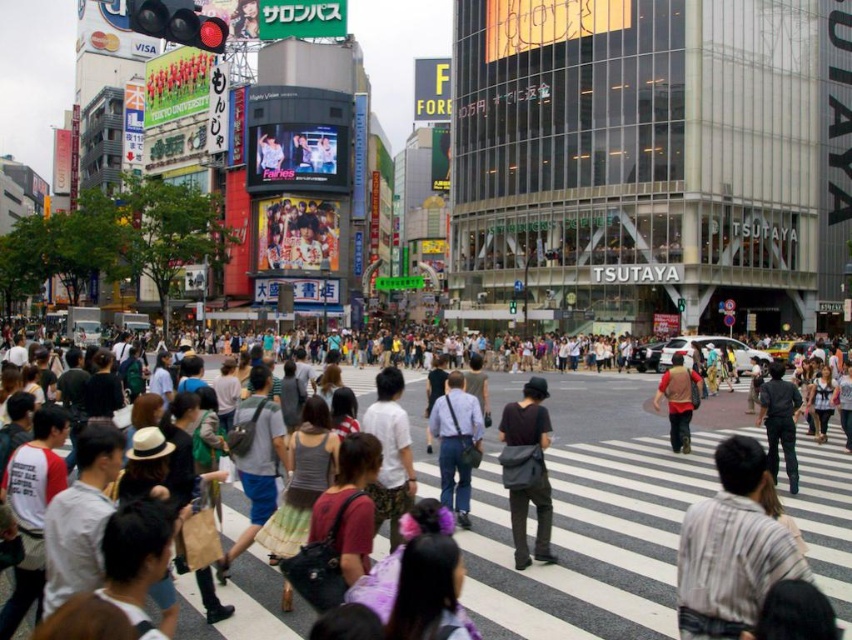
Is the position of white striped crosswalk at center less distant than that of matte blue jeans at center?

Yes, it is.

Is white striped crosswalk at center wider than matte blue jeans at center?

Correct, the width of white striped crosswalk at center exceeds that of matte blue jeans at center.

Is point (478, 508) in front of point (445, 432)?

No, (478, 508) is behind (445, 432).

Image resolution: width=852 pixels, height=640 pixels. I want to click on white striped crosswalk at center, so click(596, 509).

Who is positioned more to the right, striped shirt at center or white cotton t-shirt at lower left?

striped shirt at center

Can you confirm if striped shirt at center is shorter than white cotton t-shirt at lower left?

Yes.

Between point (793, 572) and point (7, 492), which one is positioned in front?

Point (793, 572) is in front.

Locate an element on the screen. The width and height of the screenshot is (852, 640). striped shirt at center is located at coordinates (730, 548).

Who is taller, dark gray fabric jacket at center or matte gray tank top at center?

Standing taller between the two is dark gray fabric jacket at center.

Who is shorter, dark gray fabric jacket at center or matte gray tank top at center?

With less height is matte gray tank top at center.

Is point (761, 408) farther from viewer compared to point (819, 397)?

No, it is in front of (819, 397).

Locate an element on the screen. Image resolution: width=852 pixels, height=640 pixels. dark gray fabric jacket at center is located at coordinates pos(779,420).